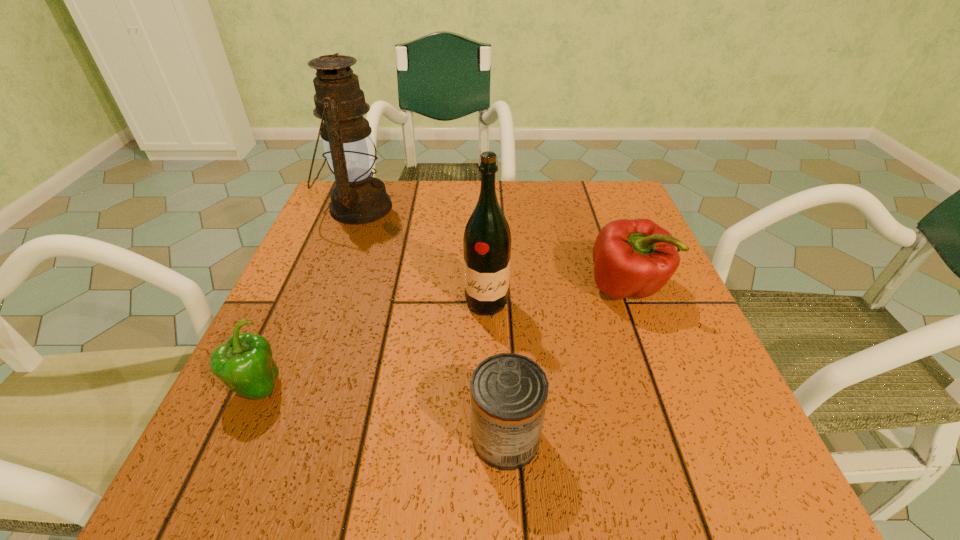
At what (x,y) coordinates should I click in order to perform the action: click on the farthest object. Please return your answer as a coordinate pair (x, y). The width and height of the screenshot is (960, 540). Looking at the image, I should click on (357, 197).

Find the location of a particular element. the second tallest object is located at coordinates (487, 238).

This screenshot has height=540, width=960. What are the coordinates of `the farther bell pepper` in the screenshot? It's located at (637, 257).

Where is `the right bell pepper`? the right bell pepper is located at coordinates (637, 257).

At what (x,y) coordinates should I click in order to perform the action: click on the nearer bell pepper. Please return your answer as a coordinate pair (x, y). The image size is (960, 540). Looking at the image, I should click on (244, 364).

This screenshot has height=540, width=960. In order to click on can in this screenshot , I will do `click(509, 392)`.

Where is `free location located 0.350m on the right of the farthest object`? Image resolution: width=960 pixels, height=540 pixels. free location located 0.350m on the right of the farthest object is located at coordinates (535, 207).

This screenshot has width=960, height=540. I want to click on vacant space situated on the front-facing side of the liquor, so (489, 462).

The image size is (960, 540). I want to click on vacant area situated on the back of the right bell pepper, so click(608, 241).

Find the location of a particular element. Image resolution: width=960 pixels, height=540 pixels. blank area located on the back of the left bell pepper is located at coordinates (306, 279).